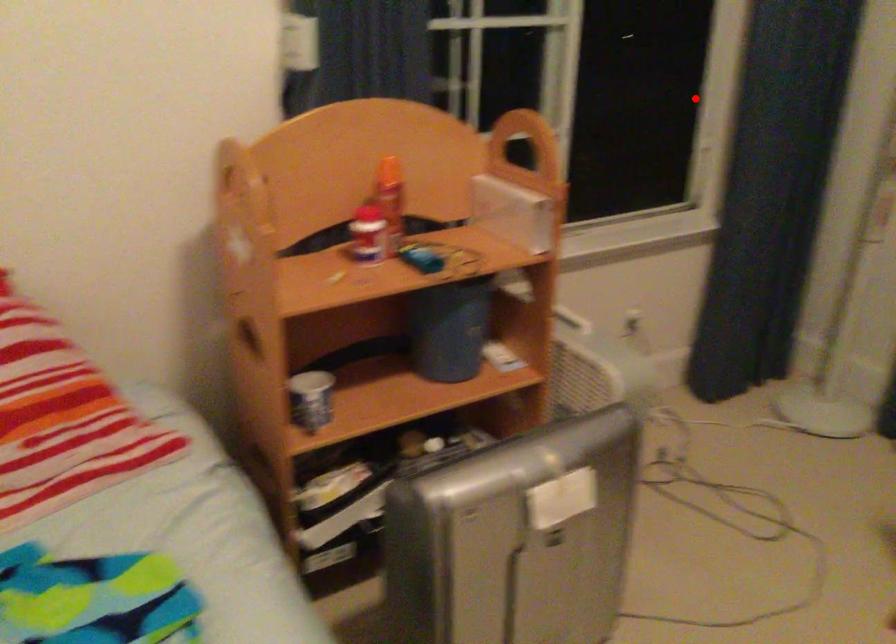
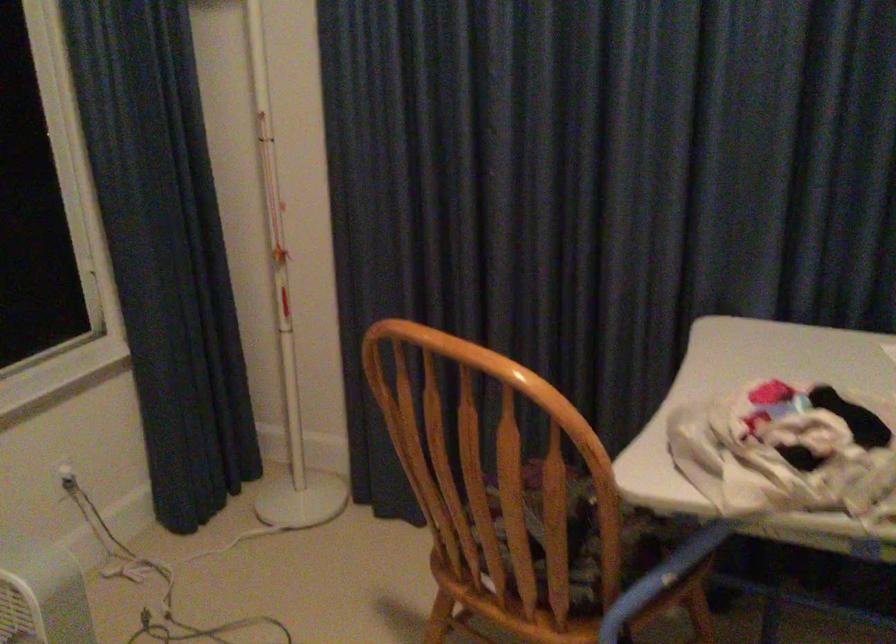
Where in the second image is the point corresponding to the highlighted location from the first image?

(66, 230)